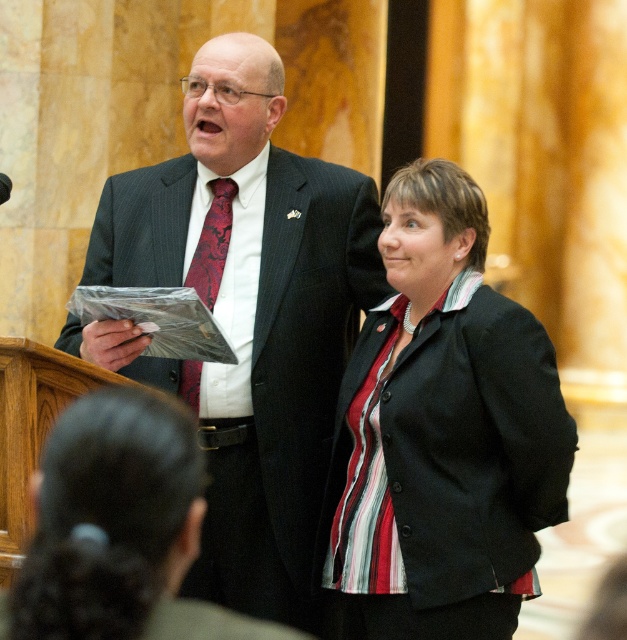
Does point (280, 237) come closer to viewer compared to point (477, 614)?

No, it is not.

From the picture: Is matte black suit at center below striped fabric jacket at center?

Indeed, matte black suit at center is positioned under striped fabric jacket at center.

I want to click on matte black suit at center, so click(245, 316).

Does matte black suit at center appear on the right side of shiny silk tie at center?

Correct, you'll find matte black suit at center to the right of shiny silk tie at center.

Does matte black suit at center have a smaller size compared to shiny silk tie at center?

No.

Who is more distant from viewer, (201, 196) or (206, 296)?

The point (201, 196) is behind.

Where is `matte black suit at center`? Image resolution: width=627 pixels, height=640 pixels. matte black suit at center is located at coordinates (245, 316).

In the scene shown: Is the position of striped fabric jacket at center more distant than that of shiny silk tie at center?

No, it is not.

Which is more to the left, striped fabric jacket at center or shiny silk tie at center?

shiny silk tie at center is more to the left.

Locate an element on the screen. This screenshot has width=627, height=640. striped fabric jacket at center is located at coordinates (443, 433).